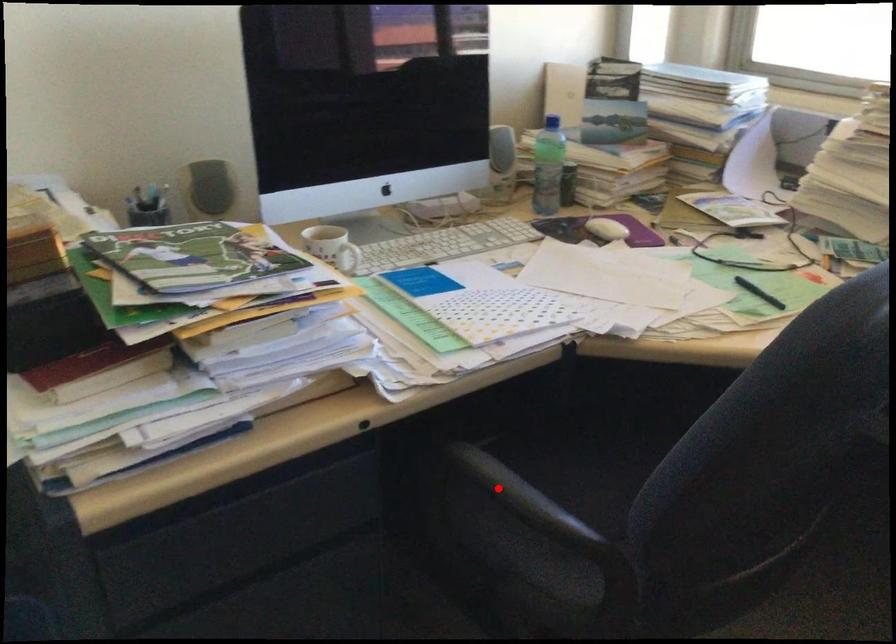
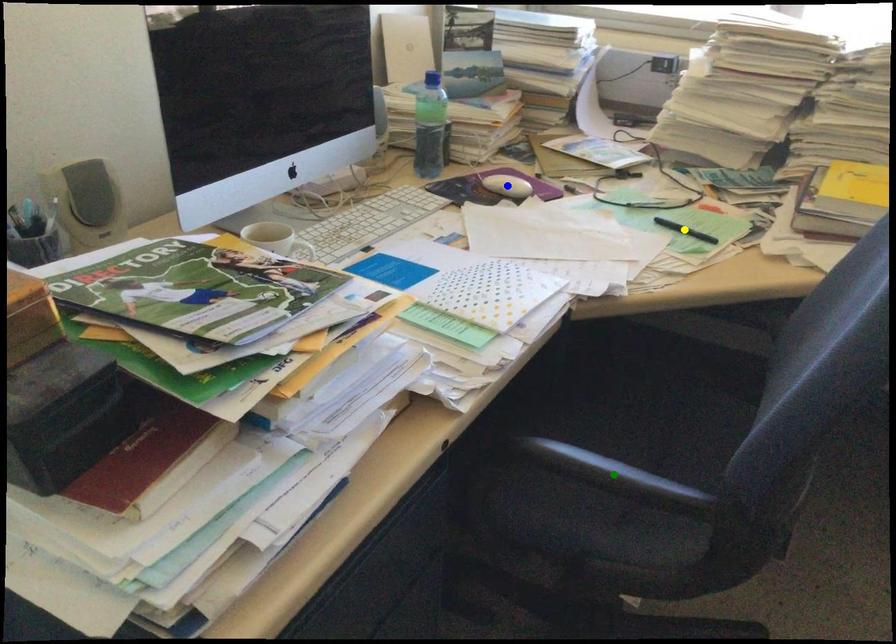
Question: I am providing you with two images of the same scene from different viewpoints. A red point is marked on the first image. You are given multiple points on the second image. Which mark in image 2 goes with the point in image 1?

Choices:
 (A) blue point
 (B) green point
 (C) yellow point

Answer: (B)